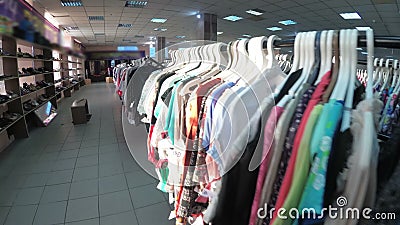
Identify the location of shoe rack. (11, 66), (25, 128), (50, 65).